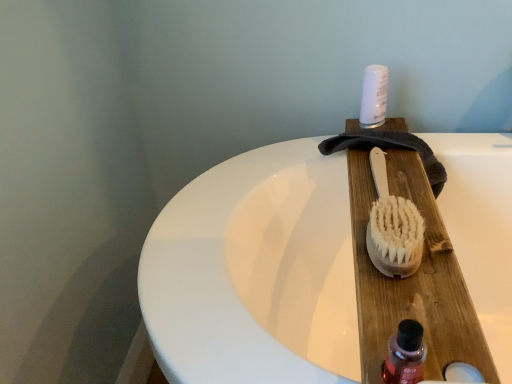
You are a GUI agent. You are given a task and a screenshot of the screen. Output one action in this format:
    pyautogui.click(x=<x>, y=<y>)
    Task: Click on the vacant area on the back side of translucent plastic bottle at lower right
    The image size is (512, 384).
    Given the screenshot: What is the action you would take?
    click(x=401, y=283)